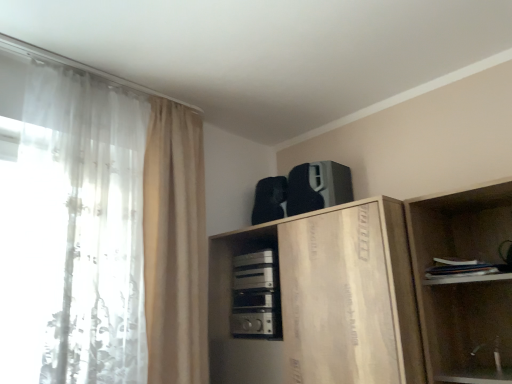
Locate an element on the screen. empty space that is ontop of white sheer curtain at left, acting as the second curtain starting from the right is located at coordinates (85, 68).